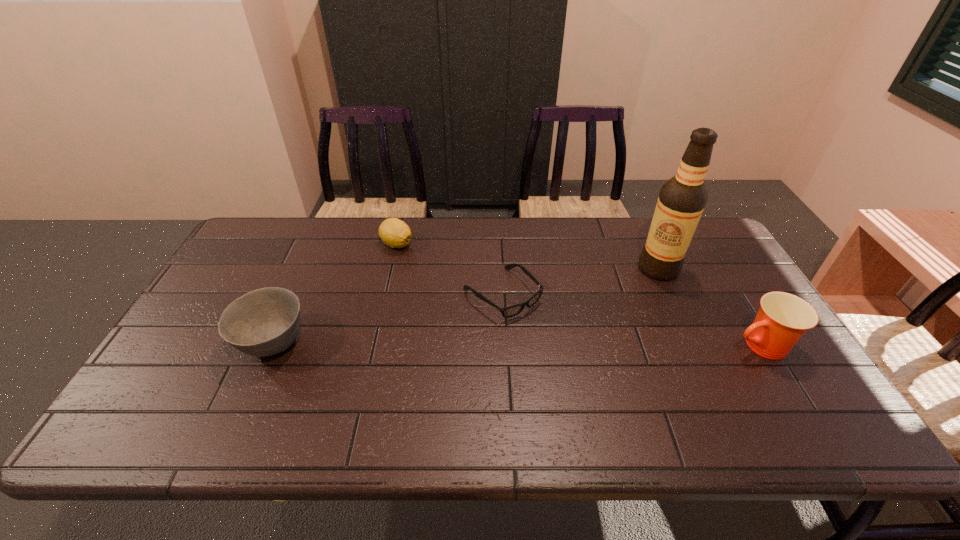
I want to click on free region located on the back of the leftmost object, so click(319, 242).

Identify the location of blank space located on the back of the cup. Image resolution: width=960 pixels, height=540 pixels. (714, 272).

The height and width of the screenshot is (540, 960). In order to click on free space located on the label of the tallest object in this screenshot , I will do `click(541, 325)`.

Where is `free point located 0.120m on the label of the tallest object`? The height and width of the screenshot is (540, 960). free point located 0.120m on the label of the tallest object is located at coordinates (614, 289).

The image size is (960, 540). In order to click on free space located 0.170m on the label of the tallest object in this screenshot , I will do [602, 296].

Identify the location of free region located 0.220m on the front-facing side of the spectacles. This screenshot has width=960, height=540. (585, 371).

Locate an element on the screen. free space located on the front-facing side of the spectacles is located at coordinates (544, 333).

Identify the location of free point located 0.310m on the front-facing side of the spectacles. This screenshot has width=960, height=540. (612, 397).

Where is `vacant region located at the stem end of the second shortest object`? vacant region located at the stem end of the second shortest object is located at coordinates (419, 279).

At what (x,y) coordinates should I click in order to perform the action: click on vacant region located 0.250m at the stem end of the second shortest object. Please return your answer as a coordinate pair (x, y). The height and width of the screenshot is (540, 960). Looking at the image, I should click on (433, 302).